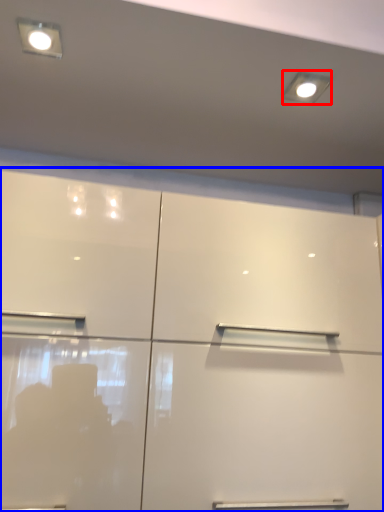
Question: Which of the following is the farthest to the observer, lighting (highlighted by a red box) or cupboard (highlighted by a blue box)?

Choices:
 (A) lighting
 (B) cupboard

Answer: (A)